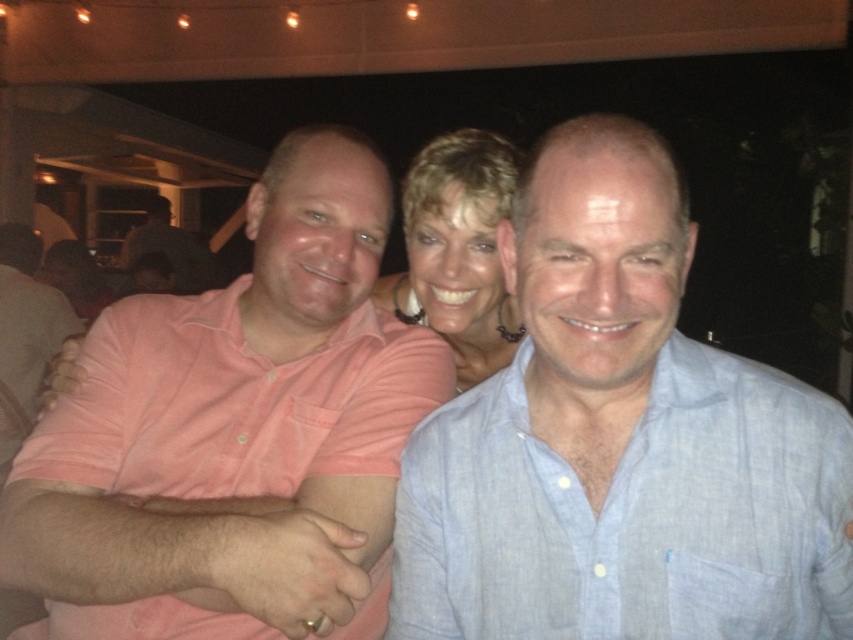
Question: Among these objects, which one is nearest to the camera?

Choices:
 (A) pink cotton shirt at center
 (B) matte gold necklace at center

Answer: (A)

Question: Is light blue linen shirt at center thinner than matte gold necklace at center?

Choices:
 (A) yes
 (B) no

Answer: (B)

Question: Which point is farther from the camera taking this photo?

Choices:
 (A) (459, 241)
 (B) (520, 200)

Answer: (A)

Question: Is pink cotton shirt at center to the left of matte gold necklace at center from the viewer's perspective?

Choices:
 (A) no
 (B) yes

Answer: (B)

Question: Does pink cotton shirt at center appear on the left side of matte gold necklace at center?

Choices:
 (A) no
 (B) yes

Answer: (B)

Question: Among these objects, which one is nearest to the camera?

Choices:
 (A) light blue linen shirt at center
 (B) pink cotton shirt at center
 (C) matte gold necklace at center

Answer: (A)